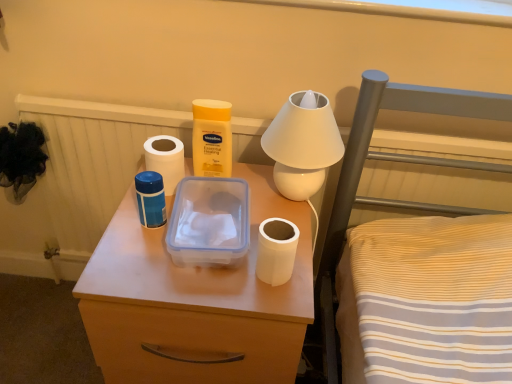
Image resolution: width=512 pixels, height=384 pixels. I want to click on free space to the right of blue plastic thermos at center, so click(249, 230).